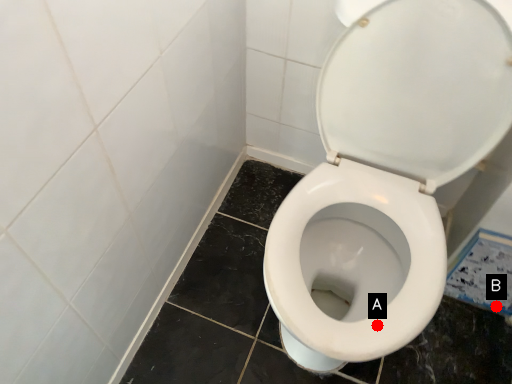
Question: Two points are circled on the image, labeled by A and B beside each circle. Among these points, which one is farthest from the camera?

Choices:
 (A) A is further
 (B) B is further

Answer: (B)